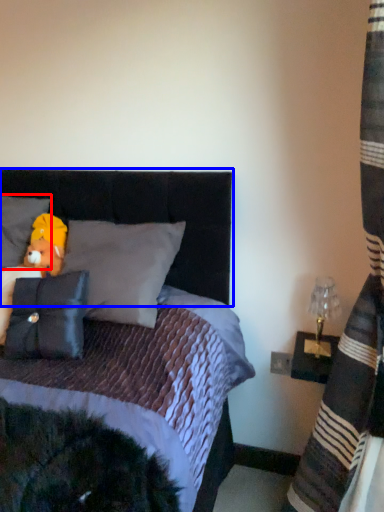
Question: Which of the following is the farthest to the observer, pillow (highlighted by a red box) or headboard (highlighted by a blue box)?

Choices:
 (A) pillow
 (B) headboard

Answer: (A)